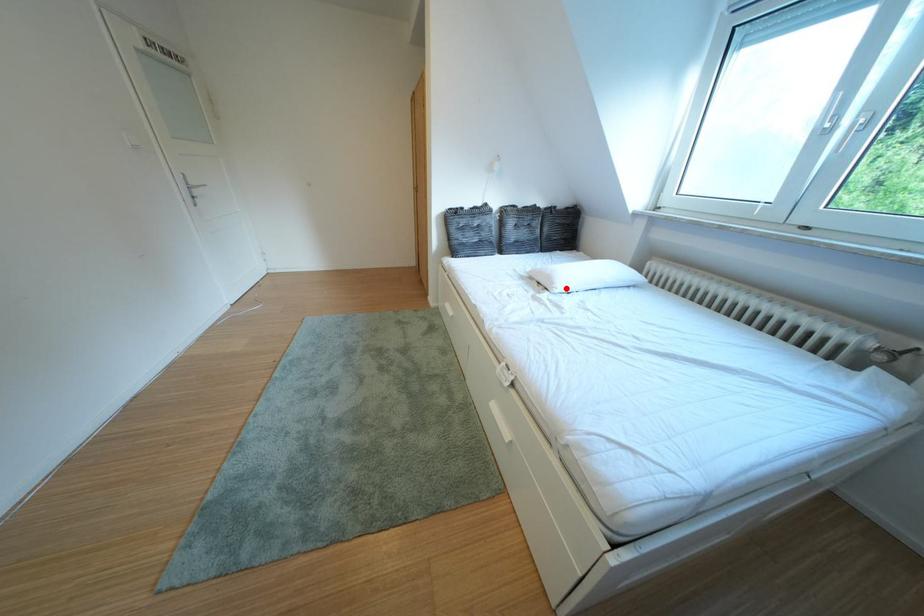
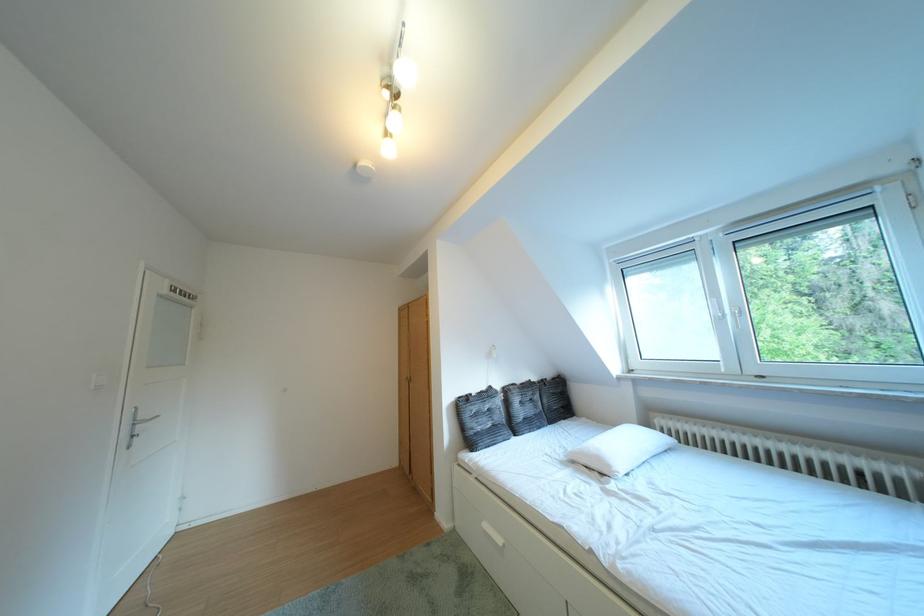
Question: I am providing you with two images of the same scene from different viewpoints. A red point is shown in image1. For the corresponding object point in image2, is it positioned nearer or farther from the camera?

Choices:
 (A) Nearer
 (B) Farther

Answer: (B)